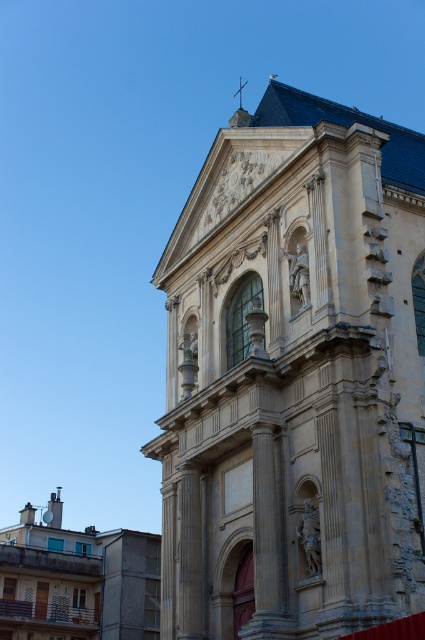
Who is higher up, beige stone church at center or matte stone church at lower left?

beige stone church at center

In the scene shown: Does beige stone church at center have a larger size compared to matte stone church at lower left?

No.

Which is behind, point (240, 291) or point (90, 596)?

Point (90, 596)

This screenshot has height=640, width=425. Find the location of `beige stone church at center`. beige stone church at center is located at coordinates (294, 378).